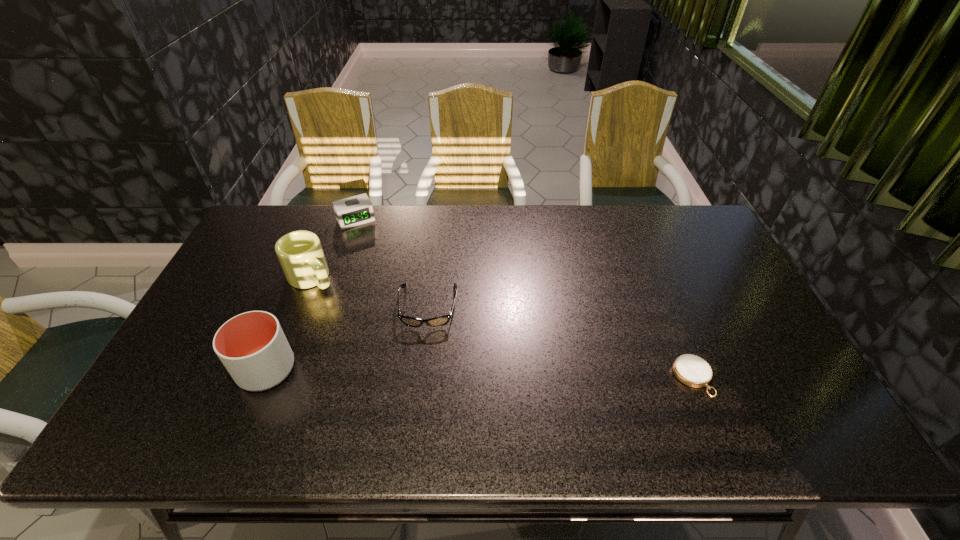
Identify the location of cup situated at the near edge. (252, 346).

Where is `compass positioned at the near edge`? This screenshot has height=540, width=960. compass positioned at the near edge is located at coordinates (691, 370).

Where is `vacant point at the far edge`? This screenshot has width=960, height=540. vacant point at the far edge is located at coordinates (x=584, y=236).

Identify the location of blank space at the near edge of the desktop. Image resolution: width=960 pixels, height=540 pixels. (303, 397).

The image size is (960, 540). In order to click on vacant space at the left edge in this screenshot , I will do `click(272, 283)`.

In the image, there is a desktop. At what (x,y) coordinates should I click in order to perform the action: click on vacant space at the right edge. Please return your answer as a coordinate pair (x, y). Looking at the image, I should click on (737, 363).

At what (x,y) coordinates should I click in order to perform the action: click on vacant space that's between the rightmost object and the second shortest object. Please return your answer as a coordinate pair (x, y). The width and height of the screenshot is (960, 540). Looking at the image, I should click on (561, 342).

You are a GUI agent. You are given a task and a screenshot of the screen. Output one action in this format:
    pyautogui.click(x=<x>, y=<y>)
    Task: Click on the empty location between the mug and the second object from right to left
    The width and height of the screenshot is (960, 540).
    Given the screenshot: What is the action you would take?
    pyautogui.click(x=370, y=292)

The height and width of the screenshot is (540, 960). What are the coordinates of `unoccupied area between the spectacles and the mug` in the screenshot? It's located at (370, 292).

Where is `vacant space that's between the fourth object from left to right and the farthest object`? vacant space that's between the fourth object from left to right and the farthest object is located at coordinates (392, 264).